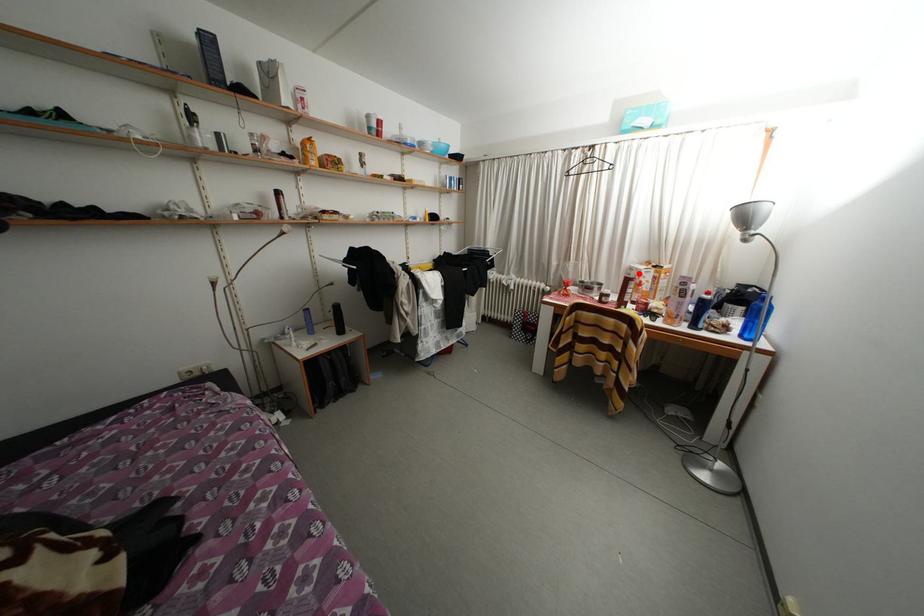
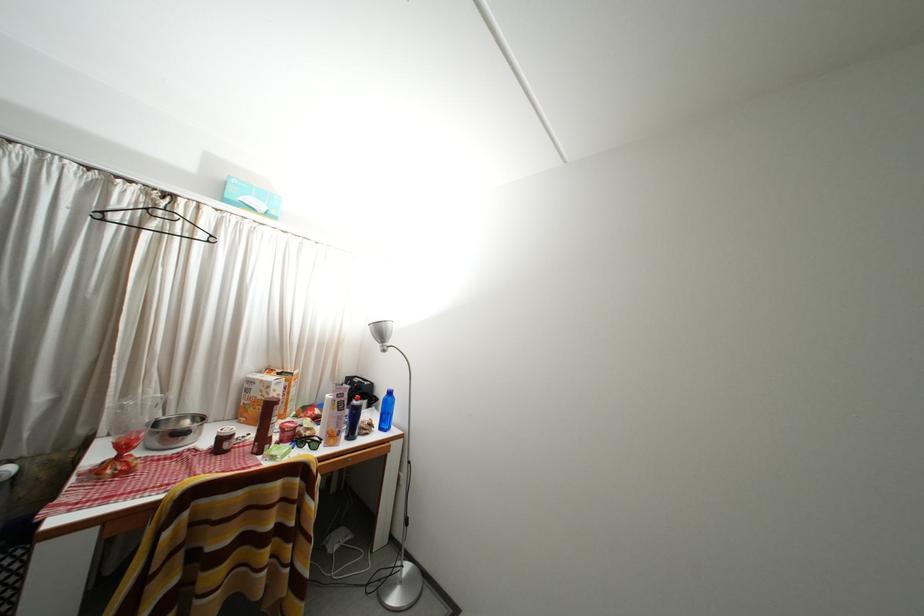
Find the pixel in the second image that matches the highlighted location in the first image.

(259, 387)